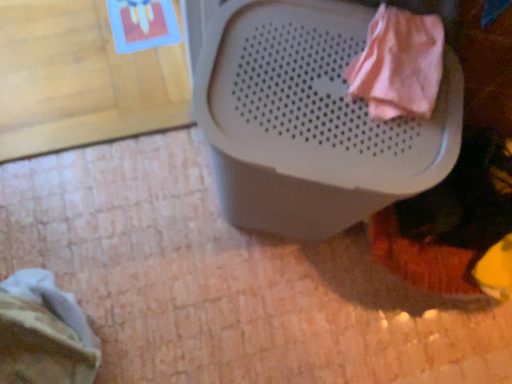
Image resolution: width=512 pixels, height=384 pixels. Find the location of `free space above white plastic waste container at upper center (from a real-world perspective)`. free space above white plastic waste container at upper center (from a real-world perspective) is located at coordinates (339, 91).